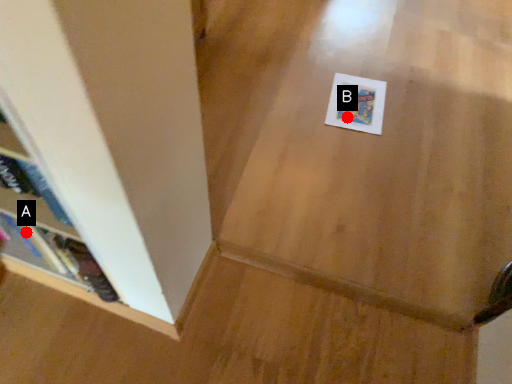
Question: Two points are circled on the image, labeled by A and B beside each circle. Which point is farther to the camera?

Choices:
 (A) A is further
 (B) B is further

Answer: (B)